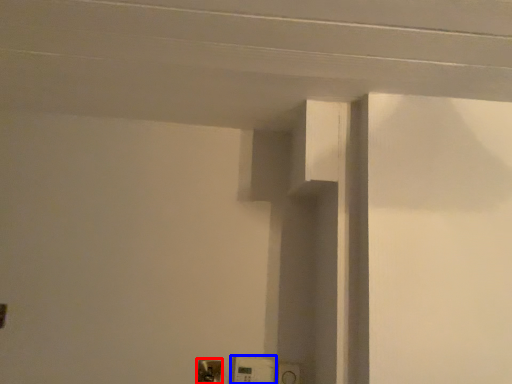
Question: Which point is closer to the camera, light switch (highlighted by a red box) or light switch (highlighted by a blue box)?

Choices:
 (A) light switch
 (B) light switch

Answer: (B)